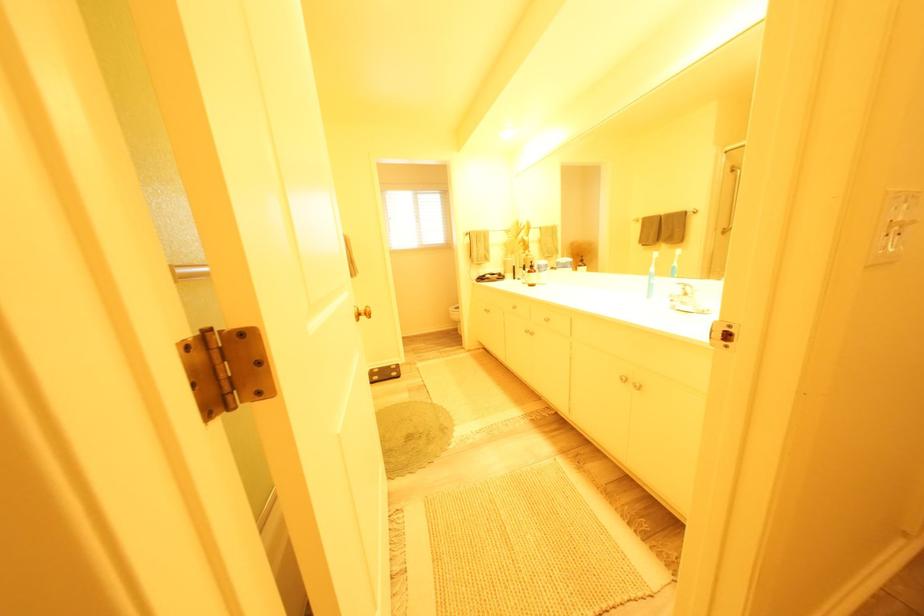
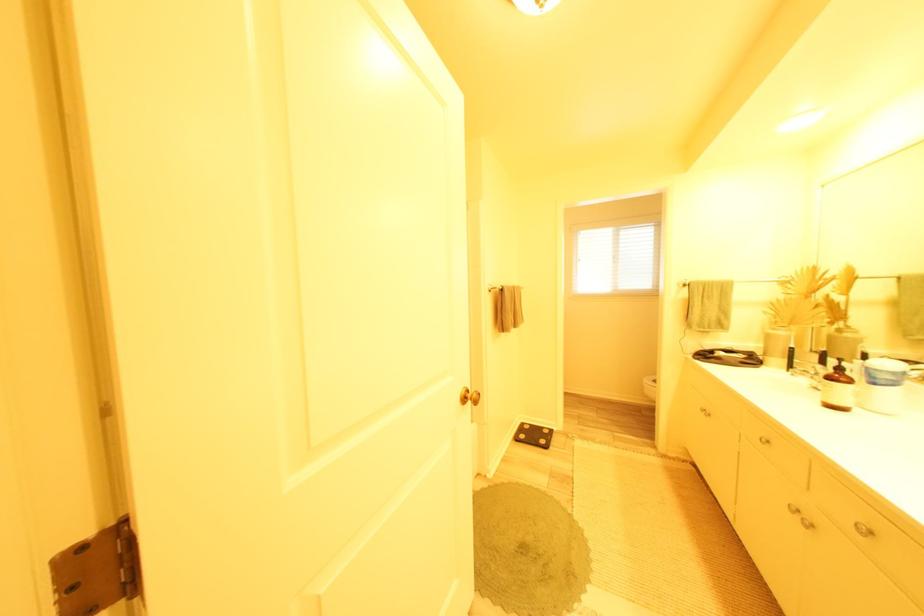
The point at (540,273) is marked in the first image. Where is the corresponding point in the second image?

(841, 379)